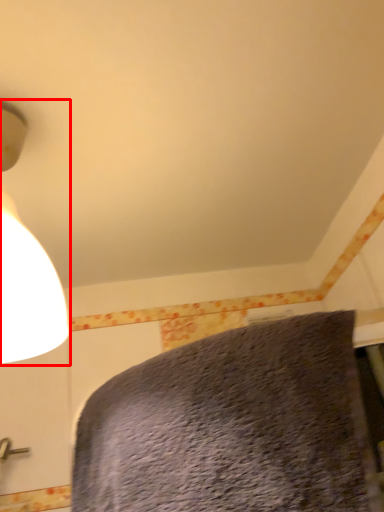
Question: Where is lamp (annotated by the red box) located in relation to bed in the image?

Choices:
 (A) right
 (B) left

Answer: (B)